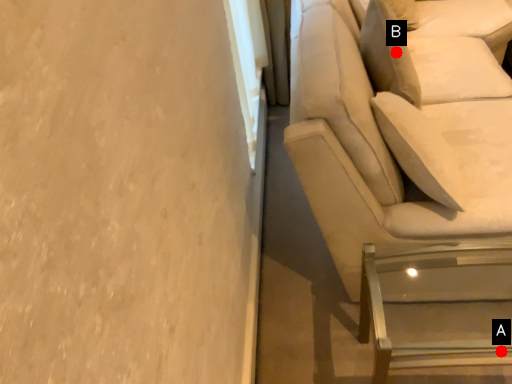
Question: Two points are circled on the image, labeled by A and B beside each circle. Which point is further to the camera?

Choices:
 (A) A is further
 (B) B is further

Answer: (B)